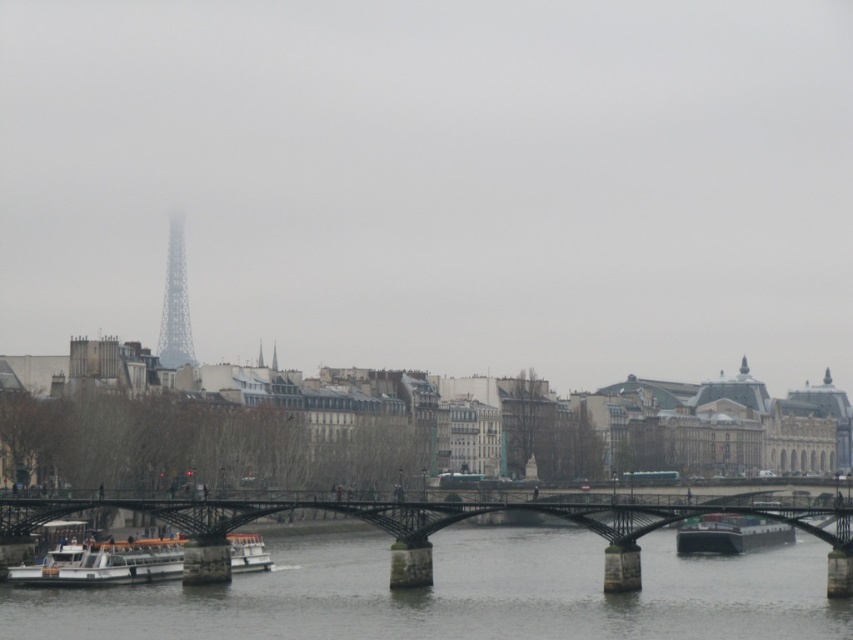
Between white matte boat at lower left and metallic gray tower at upper left, which one has less height?

white matte boat at lower left is shorter.

Can you confirm if white matte boat at lower left is taller than metallic gray tower at upper left?

No, white matte boat at lower left is not taller than metallic gray tower at upper left.

Between point (111, 579) and point (178, 305), which one is positioned behind?

Positioned behind is point (178, 305).

This screenshot has width=853, height=640. I want to click on white matte boat at lower left, so click(x=103, y=564).

Between metallic bridge at center and white matte boat at lower left, which one has less height?

white matte boat at lower left is shorter.

Identify the location of metallic bridge at center. Image resolution: width=853 pixels, height=640 pixels. (442, 528).

Who is shorter, white matte boat at lower left or green matte barge at lower right?

white matte boat at lower left

Can you confirm if white matte boat at lower left is positioned to the right of green matte barge at lower right?

Incorrect, white matte boat at lower left is not on the right side of green matte barge at lower right.

What are the coordinates of `white matte boat at lower left` in the screenshot? It's located at (103, 564).

I want to click on white matte boat at lower left, so click(x=103, y=564).